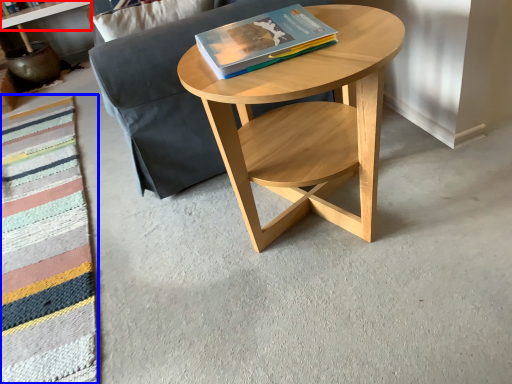
Question: Which point is further to the camera, shelf (highlighted by a red box) or blanket (highlighted by a blue box)?

Choices:
 (A) shelf
 (B) blanket

Answer: (A)